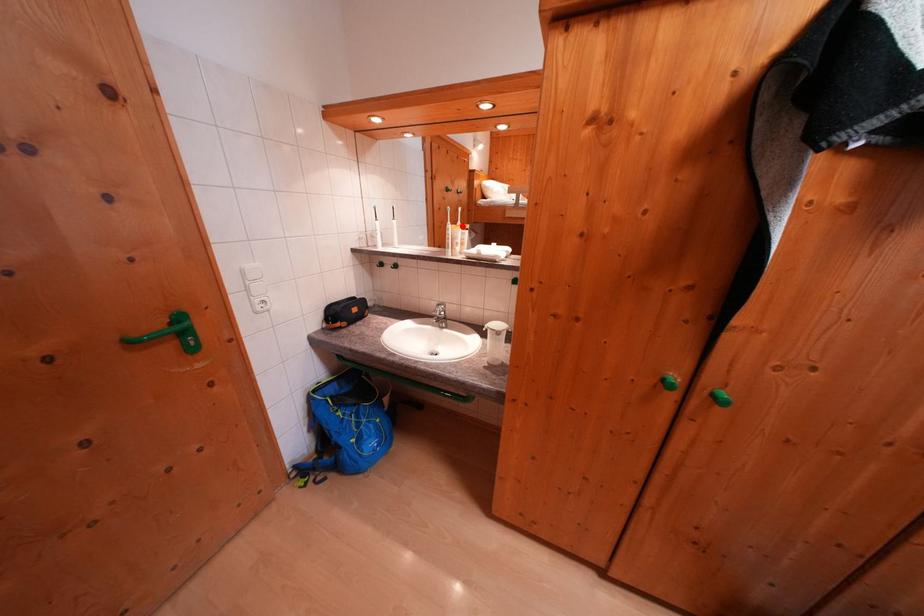
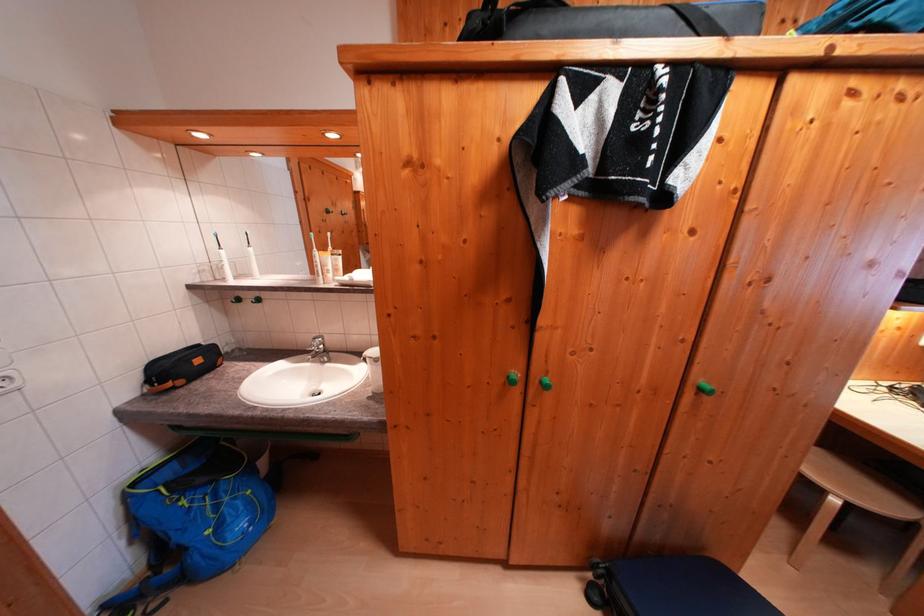
Question: I am providing you with two images of the same scene from different viewpoints. Given a red point in image1, look at the same physical point in image2. Is it:

Choices:
 (A) Closer to the viewpoint
 (B) Farther from the viewpoint

Answer: (A)